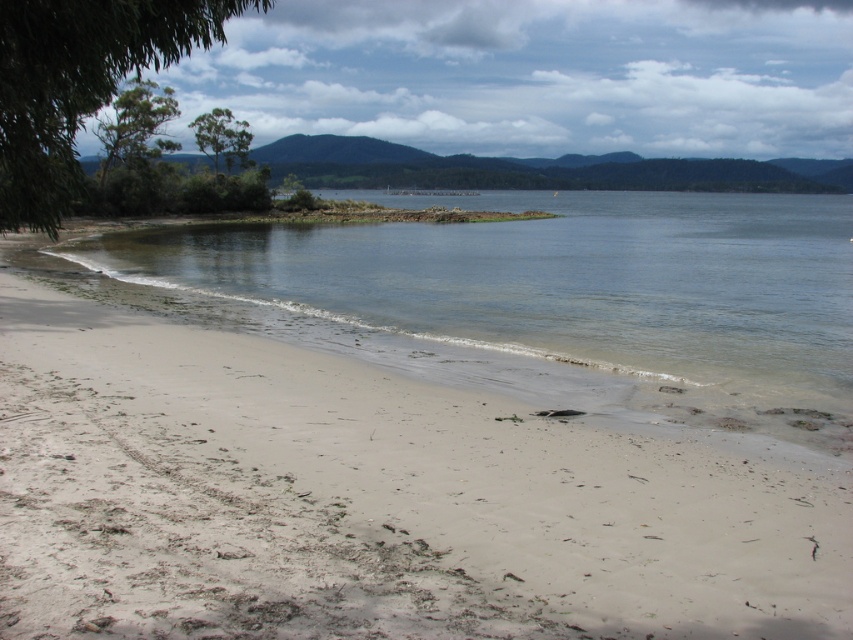
Is white sandy beach at lower left positioned behind clear water at lower center?

No, it is in front of clear water at lower center.

Describe the element at coordinates (370, 500) in the screenshot. The image size is (853, 640). I see `white sandy beach at lower left` at that location.

Is point (157, 378) farther from camera compared to point (704, 307)?

No, it is not.

This screenshot has height=640, width=853. What are the coordinates of `white sandy beach at lower left` in the screenshot? It's located at (370, 500).